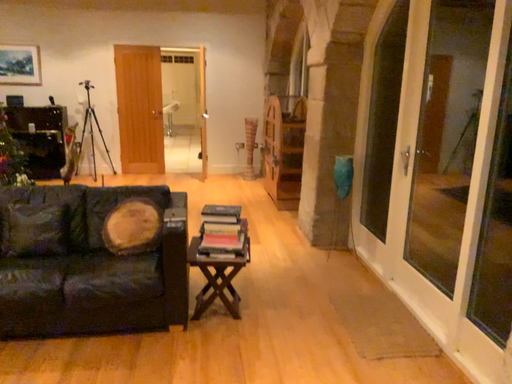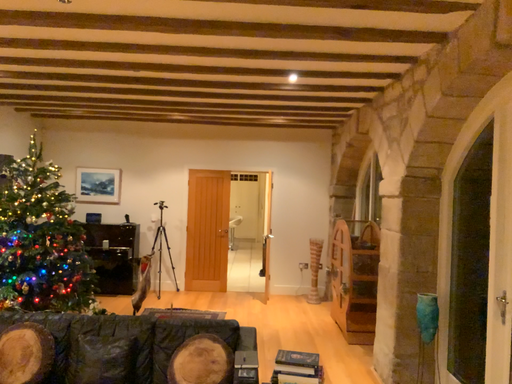
Question: How did the camera likely rotate when shooting the video?

Choices:
 (A) rotated upward
 (B) rotated downward

Answer: (A)